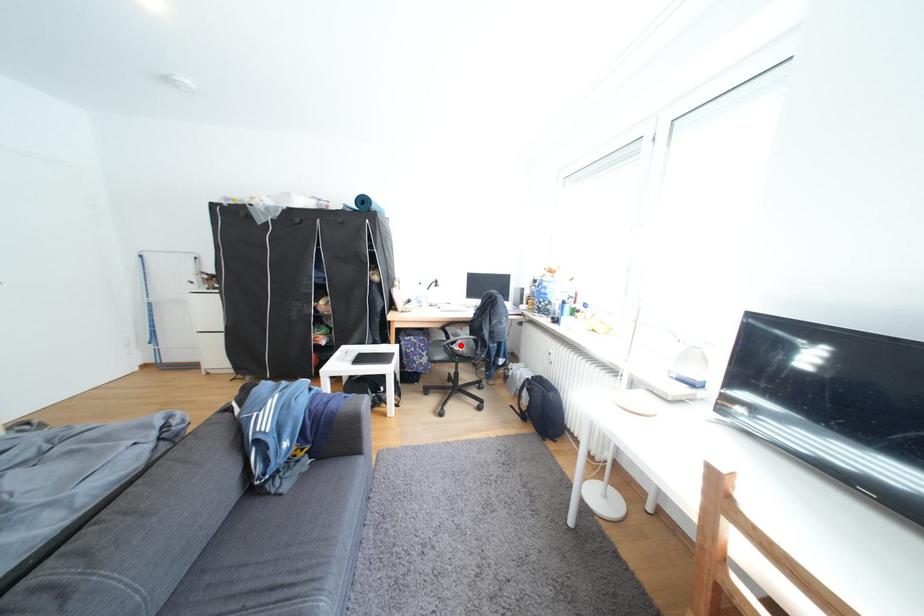
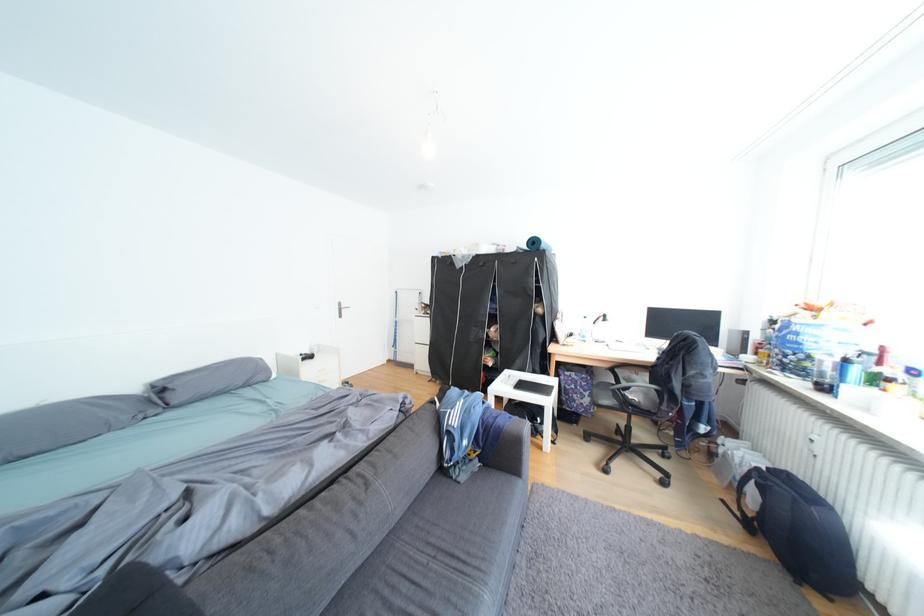
Question: I am providing you with two images of the same scene from different viewpoints. In image1, a red point is highlighted. Considering the same 3D point in image2, which of the following is correct?

Choices:
 (A) It is closer
 (B) It is farther

Answer: (A)